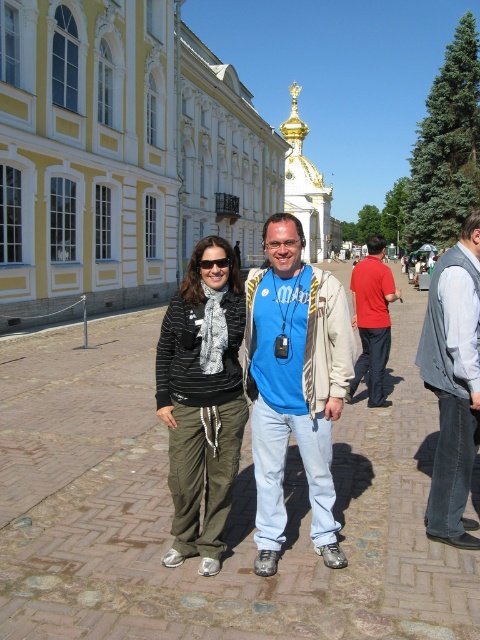
Is the position of gray fabric vest at right less distant than that of red cotton shirt at center?

Yes.

Is gray fabric vest at right to the right of red cotton shirt at center from the viewer's perspective?

Incorrect, gray fabric vest at right is not on the right side of red cotton shirt at center.

Who is more forward, (472, 333) or (359, 369)?

Point (472, 333)

At what (x,y) coordinates should I click in order to perform the action: click on gray fabric vest at right. Please return your answer as a coordinate pair (x, y). The width and height of the screenshot is (480, 640). Looking at the image, I should click on (454, 384).

Can you confirm if striped fabric scarf at center is shorter than red cotton shirt at center?

Indeed, striped fabric scarf at center has a lesser height compared to red cotton shirt at center.

Is striped fabric scarf at center thinner than red cotton shirt at center?

Yes.

Which is in front, point (182, 464) or point (369, 394)?

Point (182, 464) is more forward.

This screenshot has height=640, width=480. I want to click on striped fabric scarf at center, so click(202, 397).

Who is shorter, striped fabric scarf at center or gray fabric vest at right?

With less height is striped fabric scarf at center.

The image size is (480, 640). What do you see at coordinates (202, 397) in the screenshot? I see `striped fabric scarf at center` at bounding box center [202, 397].

At what (x,y) coordinates should I click in order to perform the action: click on striped fabric scarf at center. Please return your answer as a coordinate pair (x, y). The image size is (480, 640). Looking at the image, I should click on (202, 397).